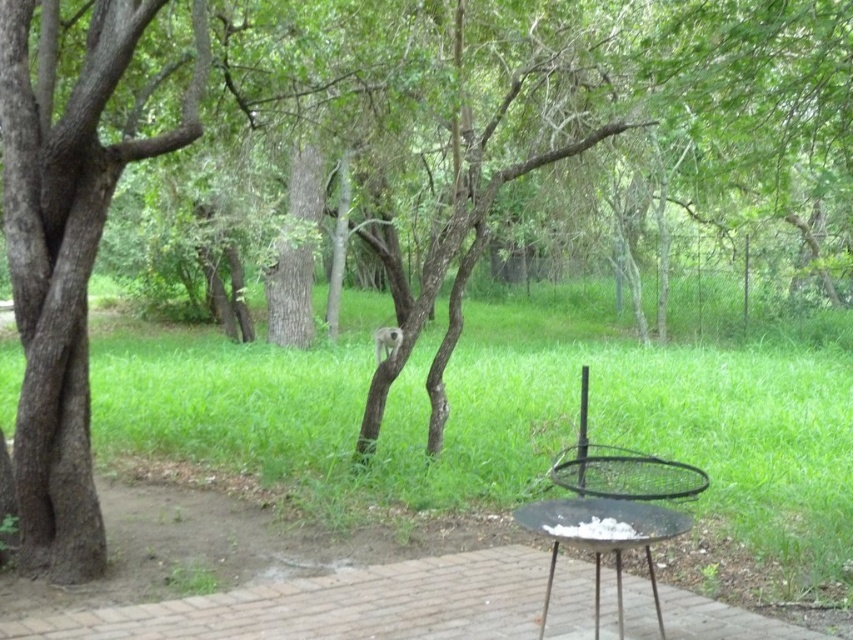
Question: Is green grass at center wider than black metal grill at lower right?

Choices:
 (A) no
 (B) yes

Answer: (B)

Question: Can you confirm if green grass at center is positioned below black metal grill at lower right?

Choices:
 (A) yes
 (B) no

Answer: (B)

Question: Which of the following is the farthest from the observer?

Choices:
 (A) smooth brown tree trunk at left
 (B) green grass at center
 (C) black metal grill at lower right

Answer: (B)

Question: Which object is closer to the camera taking this photo?

Choices:
 (A) black metal grill at lower right
 (B) smooth brown tree trunk at left
 (C) green grass at center

Answer: (A)

Question: Can you confirm if green grass at center is positioned to the right of smooth brown tree trunk at left?

Choices:
 (A) no
 (B) yes

Answer: (B)

Question: Which point appears closest to the camera in this image?

Choices:
 (A) (36, 442)
 (B) (18, 378)
 (C) (584, 509)

Answer: (C)